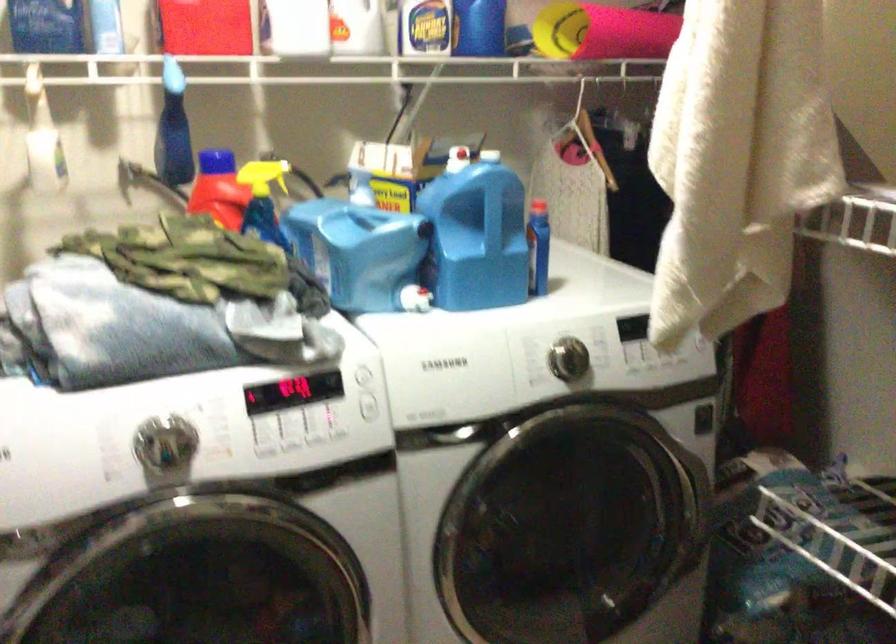
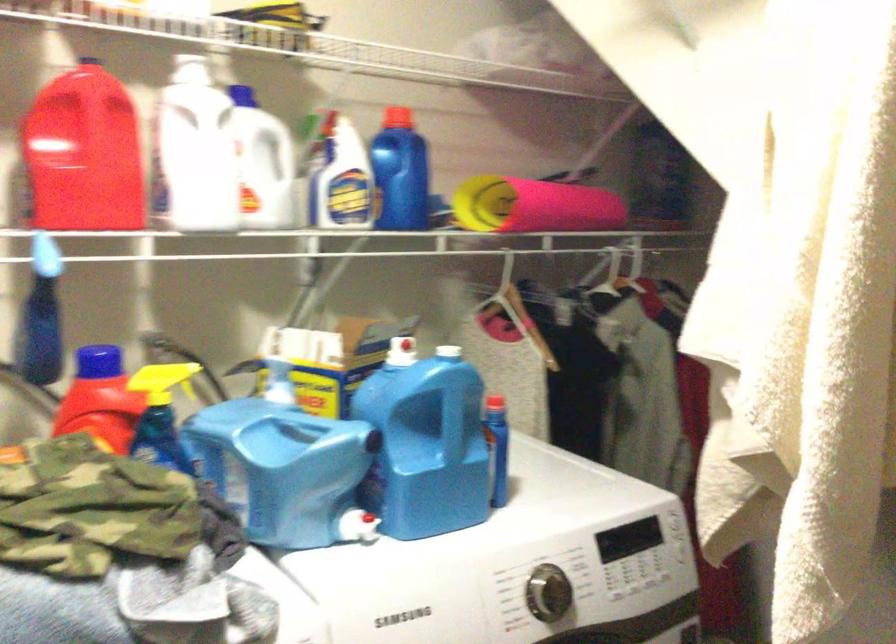
Which direction would the cameraman need to move to produce the second image?

The movement direction of the cameraman is left, forward.